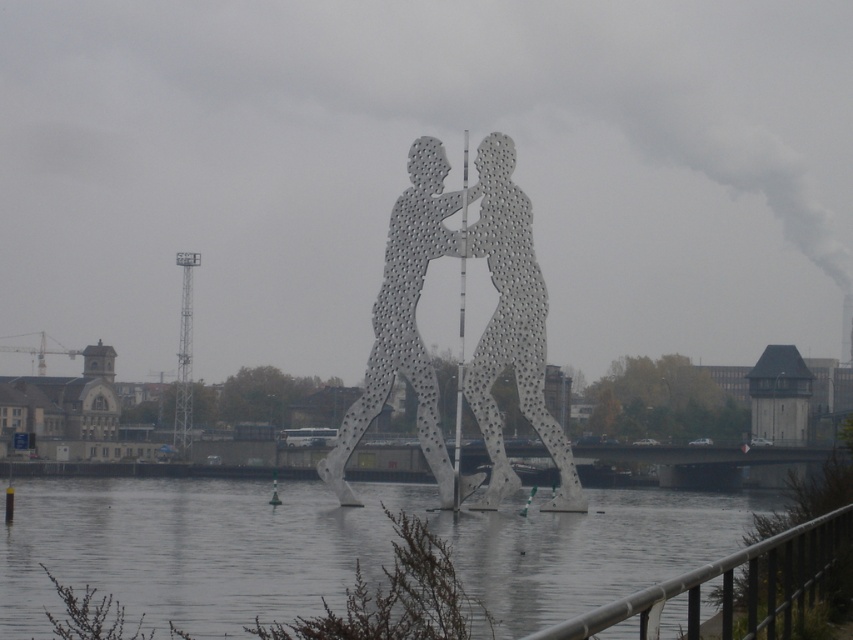
Question: Does metallic perforated figures at center appear on the right side of metallic perforated sculpture at center?

Choices:
 (A) yes
 (B) no

Answer: (B)

Question: Can you confirm if metallic perforated figures at center is positioned to the left of metallic pole at center?

Choices:
 (A) yes
 (B) no

Answer: (A)

Question: Which object is the farthest from the metallic perforated figures at center?

Choices:
 (A) metallic perforated sculpture at center
 (B) gray metallic water at center

Answer: (B)

Question: Which of these objects is positioned farthest from the metallic perforated figures at center?

Choices:
 (A) gray metallic water at center
 (B) metallic pole at center

Answer: (A)

Question: Estimate the real-world distances between objects in this image. Which object is closer to the gray metallic water at center?

Choices:
 (A) metallic perforated sculpture at center
 (B) metallic pole at center

Answer: (A)

Question: Is gray metallic water at center further to camera compared to metallic perforated sculpture at center?

Choices:
 (A) yes
 (B) no

Answer: (B)